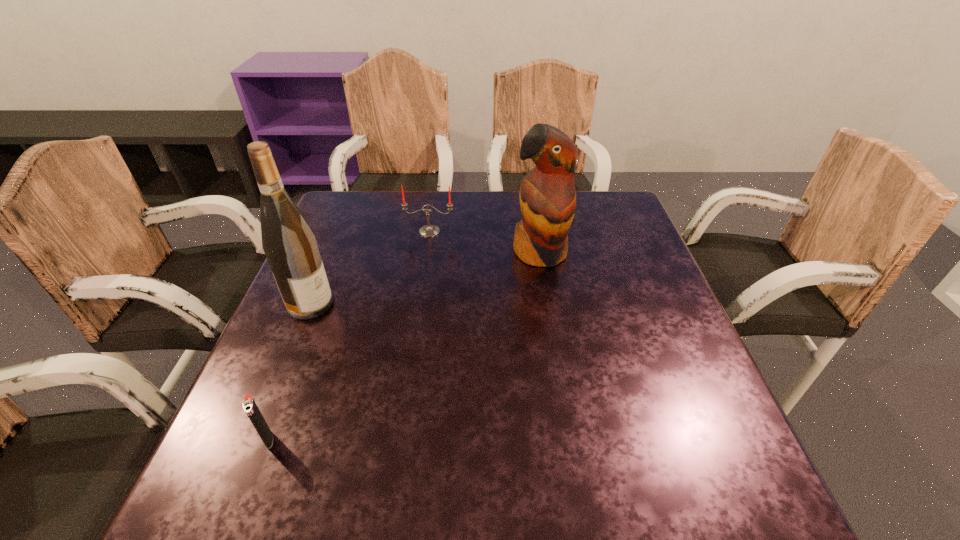
Identify which object is located as the third nearest to the parrot. Please provide its 2D coordinates. Your answer should be formatted as a tuple, i.e. [(x, y)], where the tuple contains the x and y coordinates of a point satisfying the conditions above.

[(249, 405)]

This screenshot has height=540, width=960. What are the coordinates of `object that is the nearest to the wine bottle` in the screenshot? It's located at [428, 230].